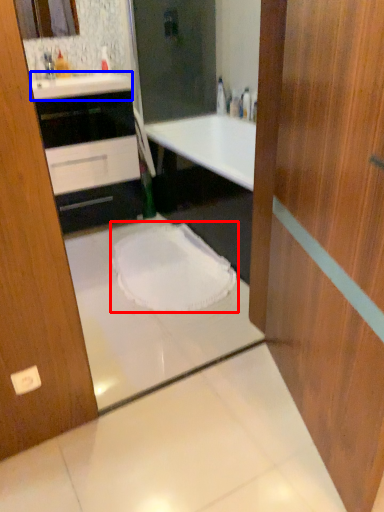
Question: Which object appears farthest to the camera in this image, toilet (highlighted by a red box) or counter top (highlighted by a blue box)?

Choices:
 (A) toilet
 (B) counter top

Answer: (B)